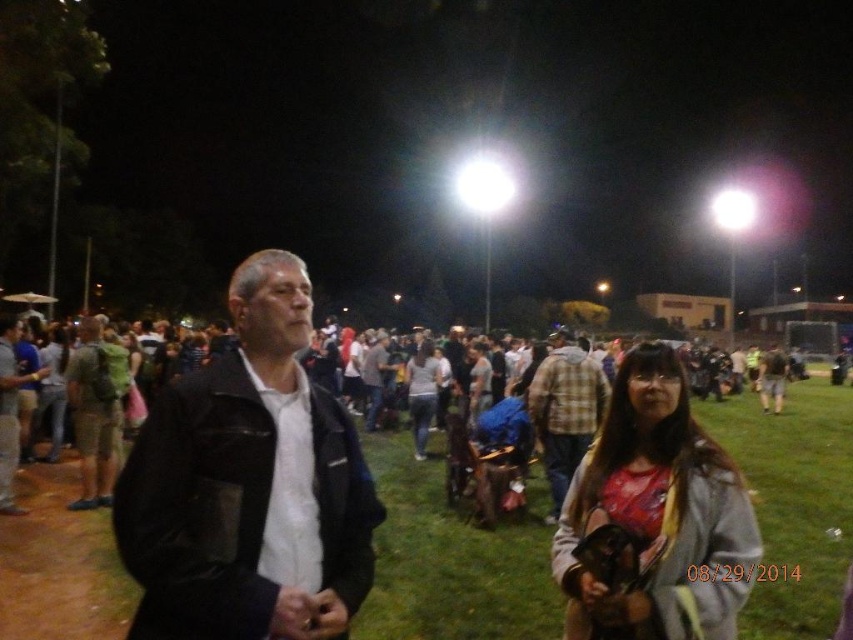
You are standing in the nighttime sports field and see the black leather jacket at center and the plaid fabric shirt at center. Which one is positioned to the left?

The black leather jacket at center is to the left of the plaid fabric shirt at center.